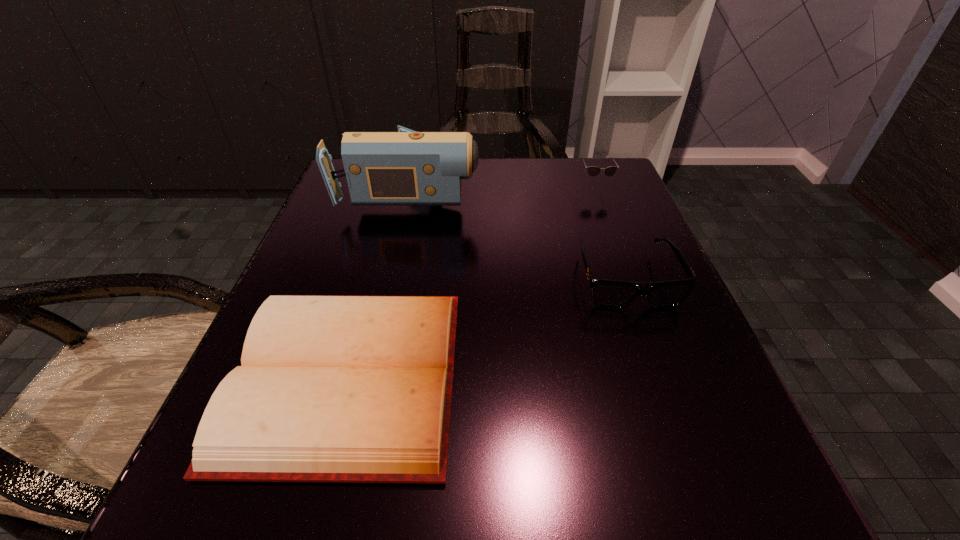
This screenshot has width=960, height=540. Identify the location of the tallest object. (406, 167).

Locate an element on the screen. The image size is (960, 540). the farther sunglasses is located at coordinates pyautogui.click(x=593, y=171).

Locate an element on the screen. This screenshot has height=540, width=960. the taller sunglasses is located at coordinates (593, 171).

Locate an element on the screen. Image resolution: width=960 pixels, height=540 pixels. the nearer sunglasses is located at coordinates (607, 294).

The width and height of the screenshot is (960, 540). Find the location of `the shorter sunglasses`. the shorter sunglasses is located at coordinates (607, 294).

At what (x,y) coordinates should I click in order to perform the action: click on Bible. Please return your answer as a coordinate pair (x, y). This screenshot has width=960, height=540. Looking at the image, I should click on (338, 389).

What are the coordinates of `vacant space located on the side of the camcorder with the flip-out screen` in the screenshot? It's located at (576, 191).

The height and width of the screenshot is (540, 960). Identify the location of vacant space located in front of the lenses of the taller sunglasses. (630, 280).

I want to click on free region located 0.270m on the front-facing side of the nearer sunglasses, so click(x=703, y=490).

Find the location of a particular element. vacant area situated 0.280m on the right of the shortest object is located at coordinates (660, 376).